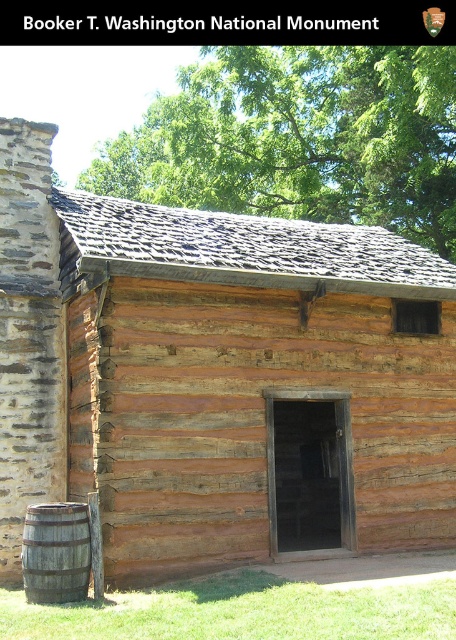
Does weathered wood cabin at center appear under rustic wooden barrel at lower left?

No, weathered wood cabin at center is not below rustic wooden barrel at lower left.

Does weathered wood cabin at center lie behind rustic wooden barrel at lower left?

That is True.

Is point (254, 220) farther from viewer compared to point (83, 529)?

Yes, point (254, 220) is farther from viewer.

Identify the location of weathered wood cabin at center. The image size is (456, 640). pyautogui.click(x=217, y=376).